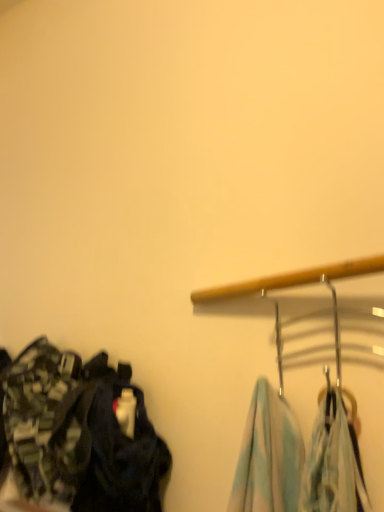
Locate an element on the screen. The image size is (384, 512). camouflage fabric jacket at lower left is located at coordinates point(78,434).

What do you see at coordinates (78, 434) in the screenshot? I see `camouflage fabric jacket at lower left` at bounding box center [78, 434].

Where is `camouflage fabric jacket at lower left`? This screenshot has width=384, height=512. camouflage fabric jacket at lower left is located at coordinates (78, 434).